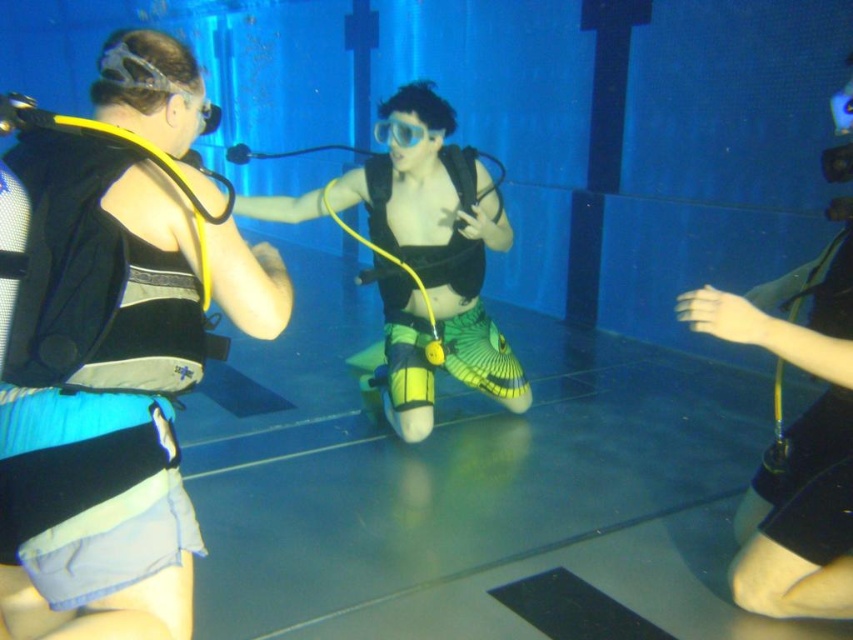
You are an underwater photographer planning to capture a shot of the blue mesh vest at left and the neon green fabric fins at center. Which object should you focus on first if you want to prioritize the closer one to the camera?

The blue mesh vest at left is closer to the camera since it has a lesser height compared to the neon green fabric fins at center, so you should focus on the blue mesh vest at left first.

You are a photographer positioned at the camera. You want to capture a closeup shot of the blue mesh vest at left without moving the vest. Can you move closer to the vest to get a better shot?

The blue mesh vest at left is 1.20 meters away from camera, so you can move closer to the vest to get a better shot since you can approach within the 1.20 meters distance.